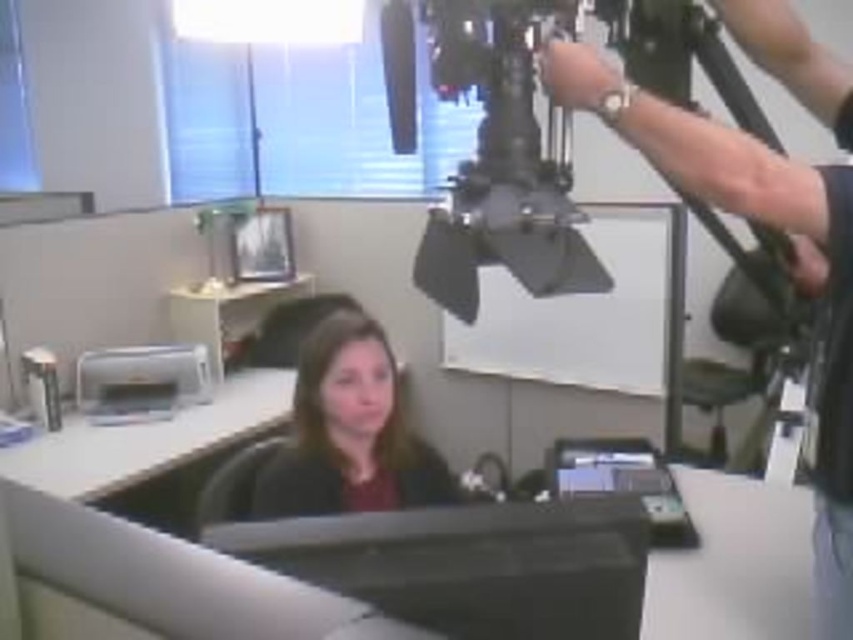
You are setting up a camera for a video call in an office. The office has a desk with a metallic silver tripod at upper right. Where should you place the camera to ensure it captures the person sitting at the desk properly?

Place the camera on the metallic silver tripod at upper right positioned at point (792, 266) to ensure proper capture of the person at the desk.

You are setting up a camera on the metallic silver tripod at upper right. To ensure the camera is above the black glossy monitor at center, is the tripod placed correctly?

Yes, the metallic silver tripod at upper right is positioned over the black glossy monitor at center, so the camera will be above the monitor when placed there.

You are setting up a camera on the metallic silver tripod at upper right to film the woman wearing the matte black shirt at center. The camera requires a minimum of 36 inches of space between the tripod and the subject to focus properly. Is the current distance sufficient?

The distance between the metallic silver tripod at upper right and the matte black shirt at center is 37.33 inches, which is just over the required 36 inches. Therefore, the current distance is sufficient for the camera to focus properly.